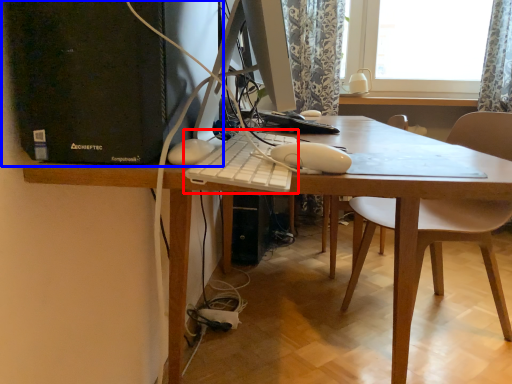
Question: Which of the following is the farthest to the observer, computer keyboard (highlighted by a red box) or computer tower (highlighted by a blue box)?

Choices:
 (A) computer keyboard
 (B) computer tower

Answer: (B)